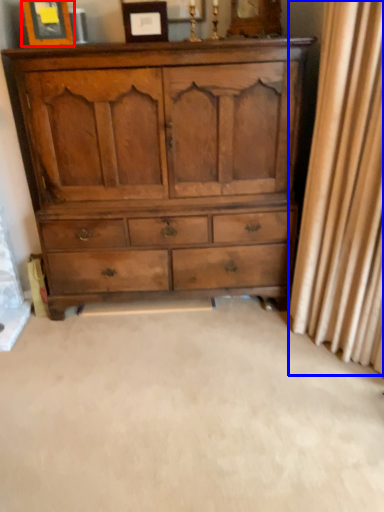
Question: Which of the following is the closest to the observer, picture frame (highlighted by a red box) or curtain (highlighted by a blue box)?

Choices:
 (A) picture frame
 (B) curtain

Answer: (B)